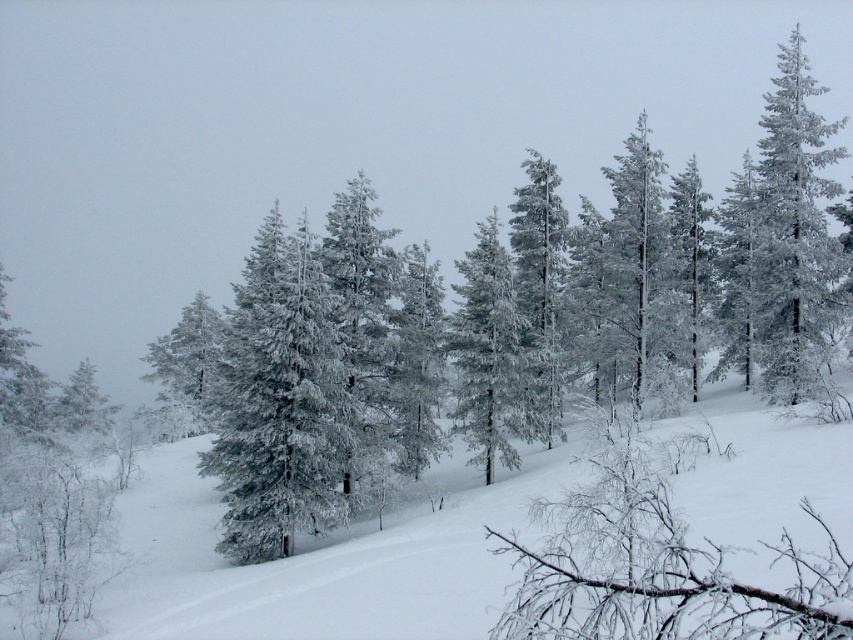
Question: Which object is positioned farthest from the white frosty tree at center?

Choices:
 (A) white frosty tree at left
 (B) snow-covered pine at center

Answer: (A)

Question: Is white frosty tree at center thinner than white frosty tree at left?

Choices:
 (A) yes
 (B) no

Answer: (A)

Question: Which of the following is the closest to the observer?

Choices:
 (A) white frosty tree at center
 (B) snow-covered evergreen at center

Answer: (B)

Question: Which object is the farthest from the snow-covered pine at center?

Choices:
 (A) white frosty tree at center
 (B) white frosty tree at left

Answer: (B)

Question: Observing the image, what is the correct spatial positioning of snow-covered evergreen at center in reference to snow-covered pine at center?

Choices:
 (A) above
 (B) below

Answer: (B)

Question: Can you confirm if snow-covered evergreen at center is positioned above white frosty tree at center?

Choices:
 (A) yes
 (B) no

Answer: (B)